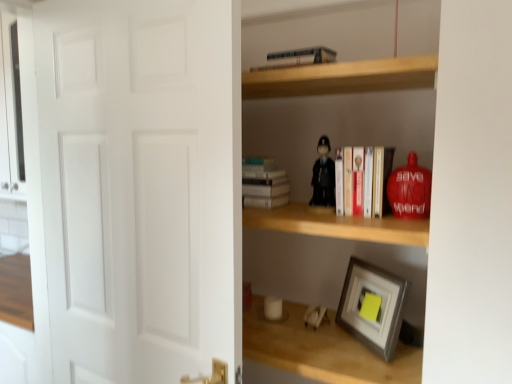
At what (x,y) coordinates should I click in order to perform the action: click on vacant region above wooden shelf at lower right, the second shelf from the top (from a real-world perspective). Please return your answer as a coordinate pair (x, y). The height and width of the screenshot is (384, 512). Looking at the image, I should click on (309, 332).